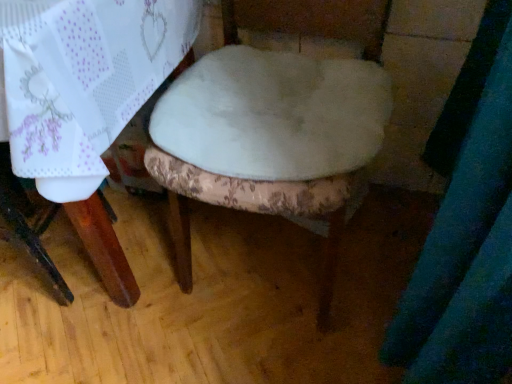
Question: From the image's perspective, is white fabric chair at center above white fabric at center?

Choices:
 (A) yes
 (B) no

Answer: (B)

Question: Is white fabric chair at center positioned with its back to white fabric at center?

Choices:
 (A) no
 (B) yes

Answer: (B)

Question: Is white fabric at center a part of white fabric chair at center?

Choices:
 (A) yes
 (B) no

Answer: (A)

Question: Is white fabric chair at center closer to the viewer compared to white fabric at center?

Choices:
 (A) no
 (B) yes

Answer: (B)

Question: Can you confirm if white fabric chair at center is taller than white fabric at center?

Choices:
 (A) no
 (B) yes

Answer: (B)

Question: From a real-world perspective, is white fabric chair at center positioned over white fabric at center based on gravity?

Choices:
 (A) yes
 (B) no

Answer: (B)

Question: Is white fabric at center facing towards white fabric chair at center?

Choices:
 (A) yes
 (B) no

Answer: (A)

Question: Does white fabric at center have a smaller size compared to white fabric chair at center?

Choices:
 (A) no
 (B) yes

Answer: (B)

Question: Does white fabric at center have a lesser height compared to white fabric chair at center?

Choices:
 (A) yes
 (B) no

Answer: (A)

Question: Is white fabric at center to the left of white fabric chair at center from the viewer's perspective?

Choices:
 (A) no
 (B) yes

Answer: (B)

Question: Does white fabric at center have a larger size compared to white fabric chair at center?

Choices:
 (A) no
 (B) yes

Answer: (A)

Question: Is white fabric at center next to white fabric chair at center and touching it?

Choices:
 (A) yes
 (B) no

Answer: (B)

Question: From their relative heights in the image, would you say white fabric chair at center is taller or shorter than white fabric at center?

Choices:
 (A) short
 (B) tall

Answer: (B)